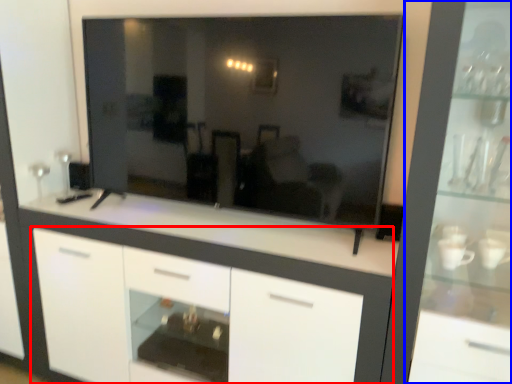
Question: Which of the following is the farthest to the observer, cabinetry (highlighted by a red box) or dresser (highlighted by a blue box)?

Choices:
 (A) cabinetry
 (B) dresser

Answer: (A)